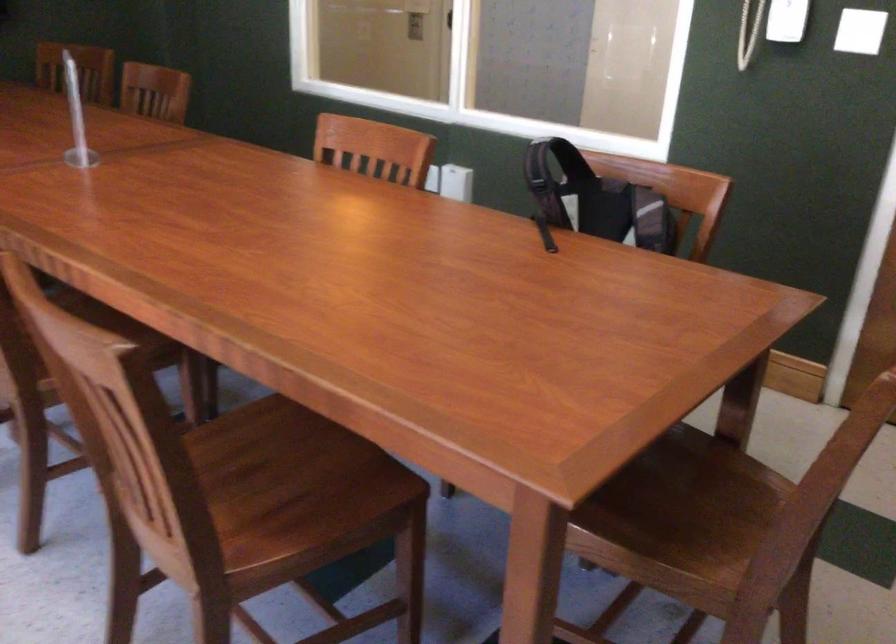
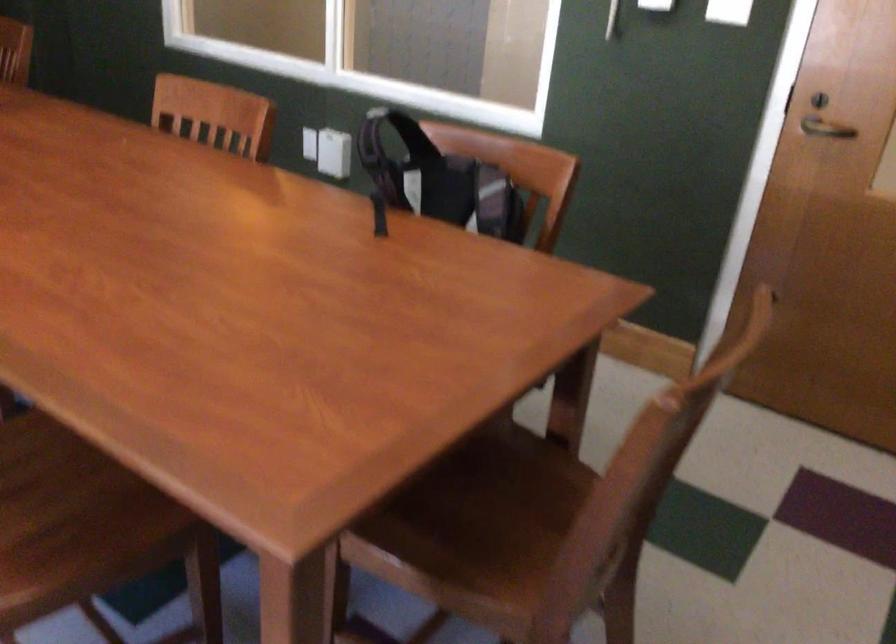
The point at [688,525] is marked in the first image. Where is the corresponding point in the second image?

(495, 536)